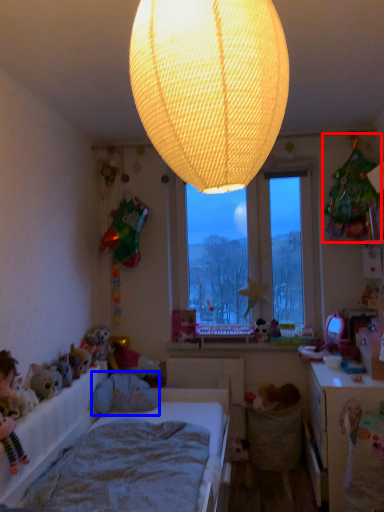
Question: Which of the following is the farthest to the observer, toy (highlighted by a red box) or animal (highlighted by a blue box)?

Choices:
 (A) toy
 (B) animal

Answer: (B)